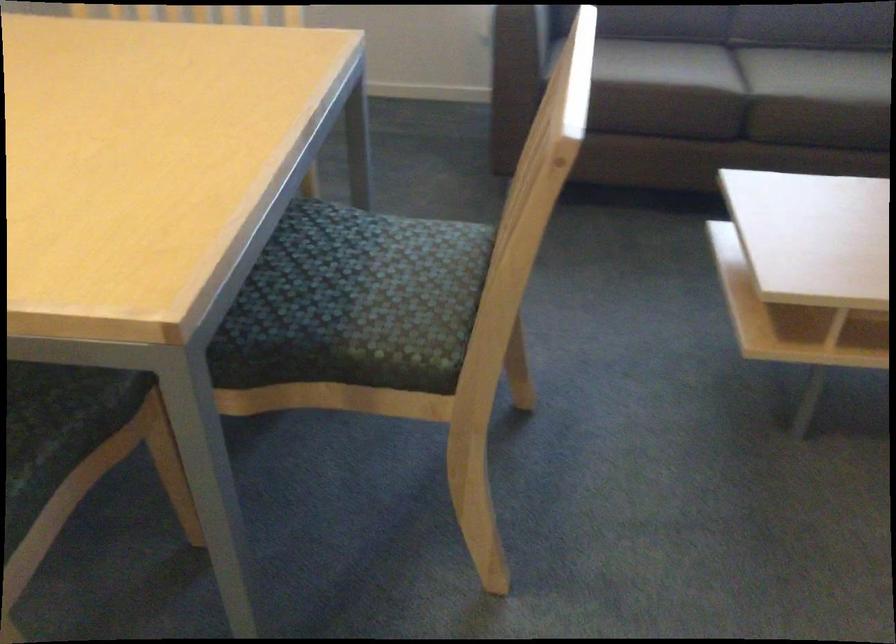
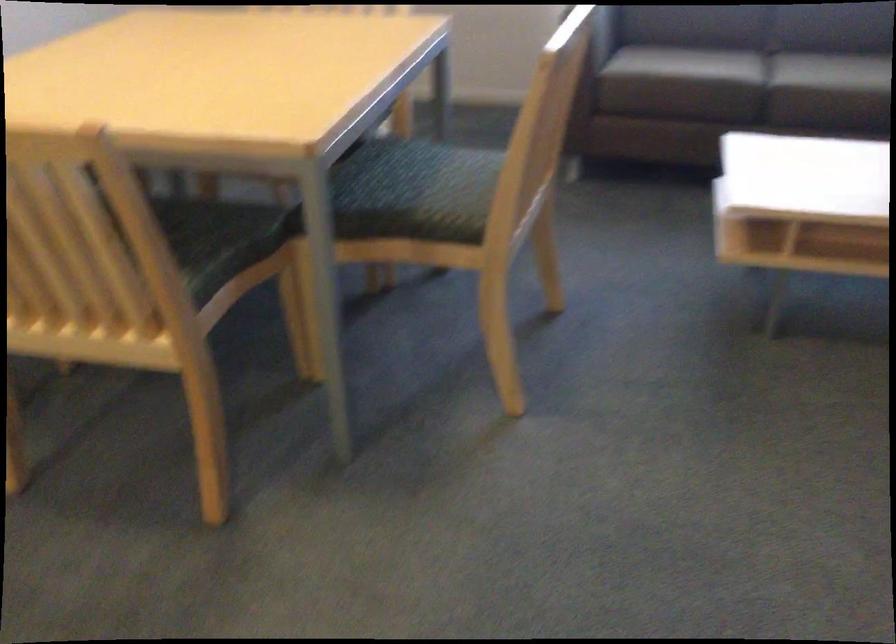
Question: Based on the continuous images, in which direction is the camera rotating? Reply with the corresponding letter.

Choices:
 (A) Left
 (B) Right
 (C) Up
 (D) Down

Answer: (A)